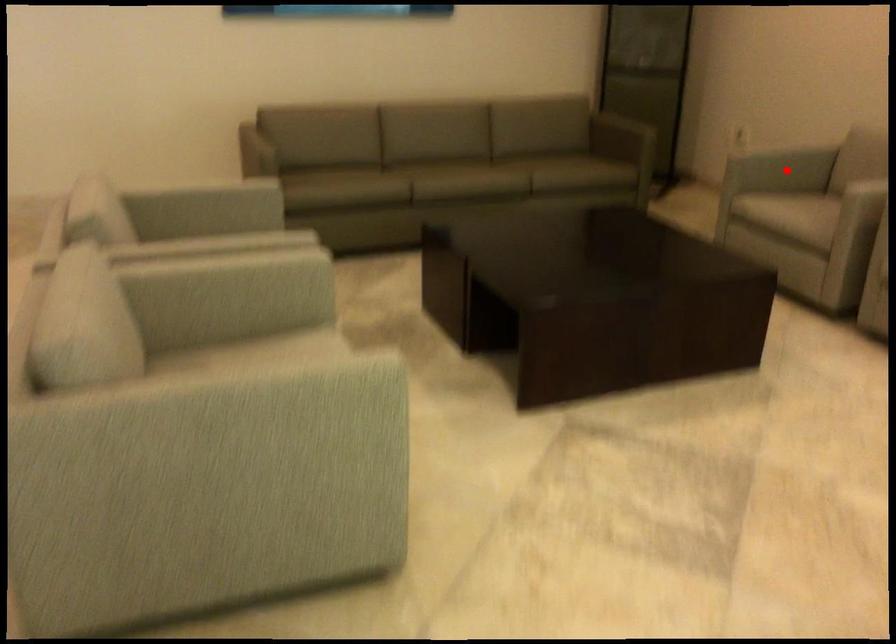
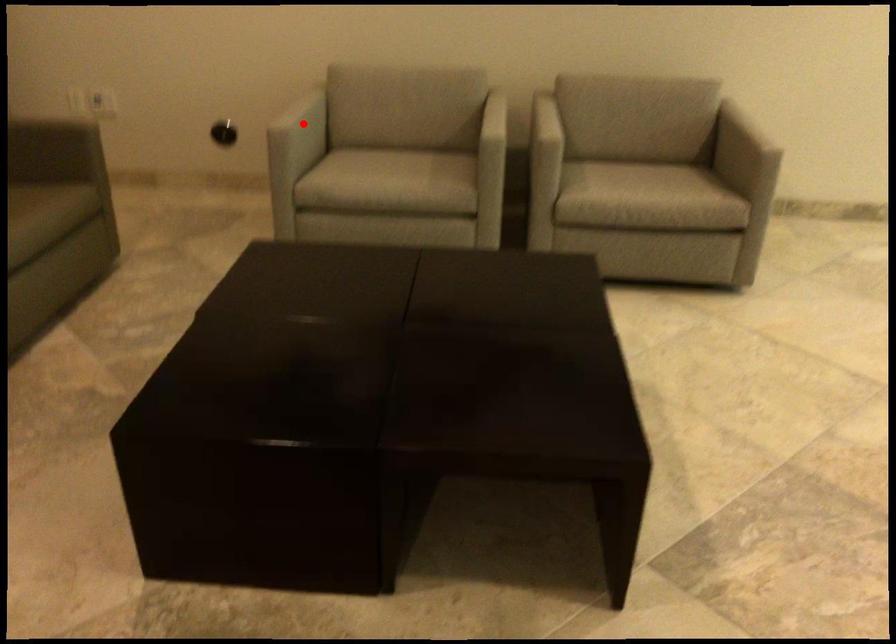
I am providing you with two images of the same scene from different viewpoints. A red point is marked on the first image and another point is marked on the second image. Is the marked point in image1 the same physical position as the marked point in image2?

Yes